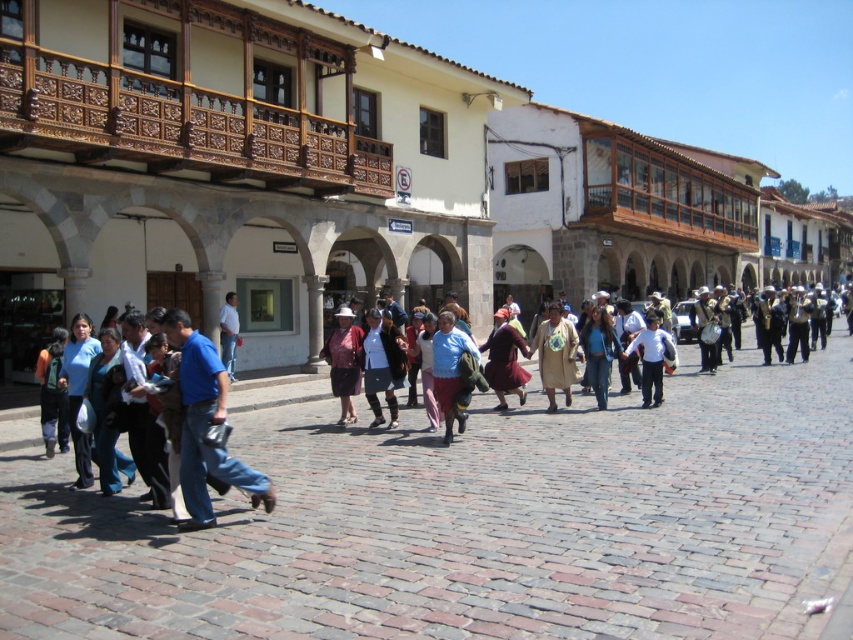
Based on the photo, you are a street performer standing in the historic town square. You see a light blue fabric at center and a matte red skirt at center. You need to place a small prop between them. Can you fit it if the prop requires 5 feet of space?

The light blue fabric at center is 6.23 feet from matte red skirt at center, so yes, the prop can be placed between them as there is enough space.

You are a photographer standing in the historic town square. You notice a person wearing a blue cotton shirt at center and blue denim jeans at center. Which clothing item is closer to you?

The blue cotton shirt at center is closer to you because it is in front of the blue denim jeans at center.

You are standing at the edge of the square and see both the blue cotton shirt at center and the blue denim jeans at center. Which one is closer to you?

The blue cotton shirt at center is 25.59 feet away from the blue denim jeans at center, so whichever is closer cannot be determined without additional information about their individual distances from your position.